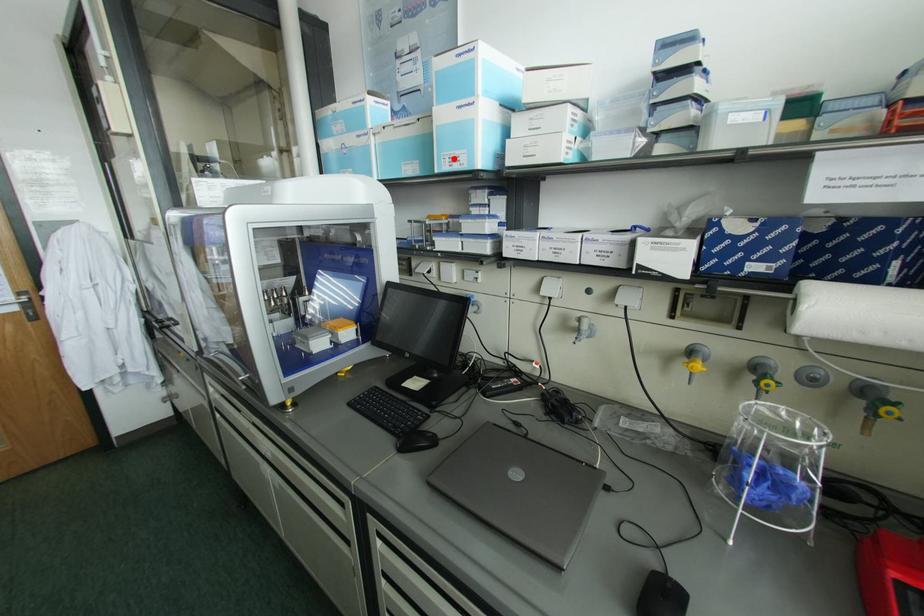
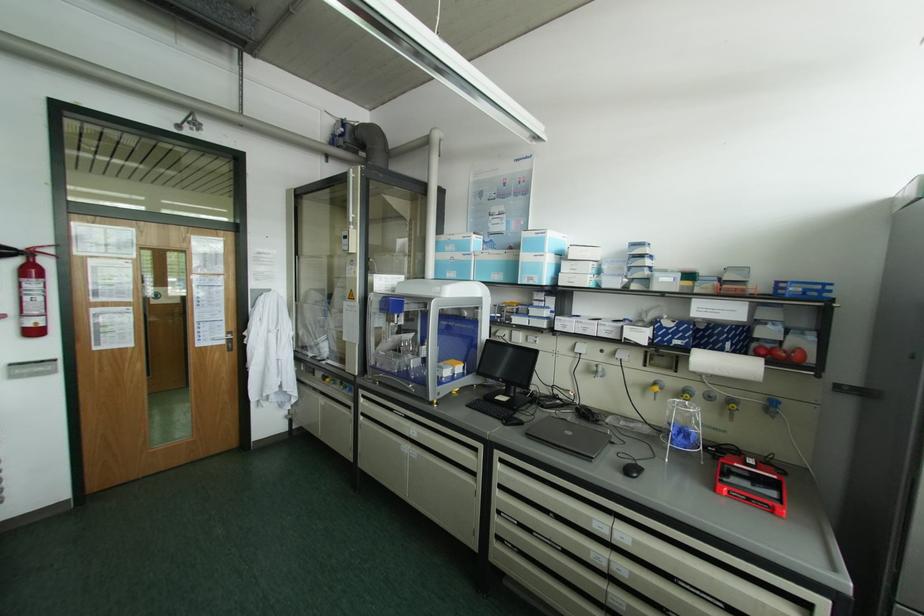
In the second image, find the point that corresponds to the highlighted location in the first image.

(530, 278)